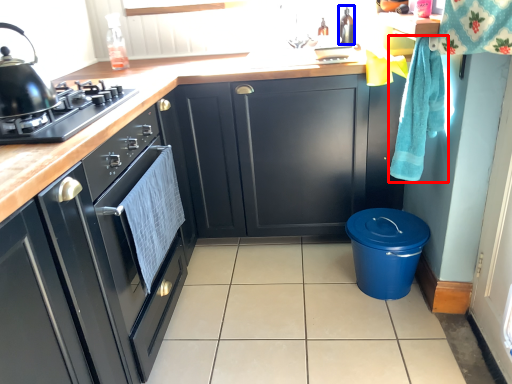
Question: Which object is closer to the camera taking this photo, hand towel (highlighted by a red box) or appliance (highlighted by a blue box)?

Choices:
 (A) hand towel
 (B) appliance

Answer: (A)